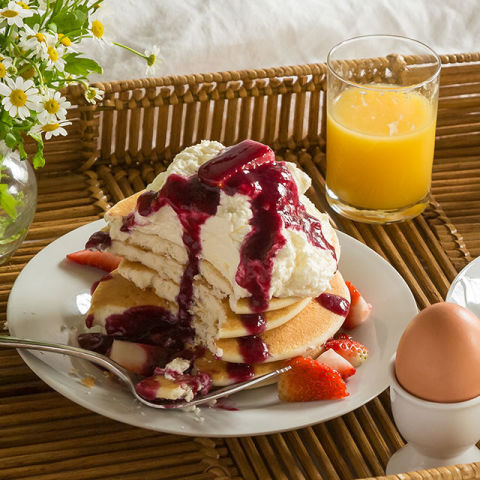
Identify the location of table. (61, 449).